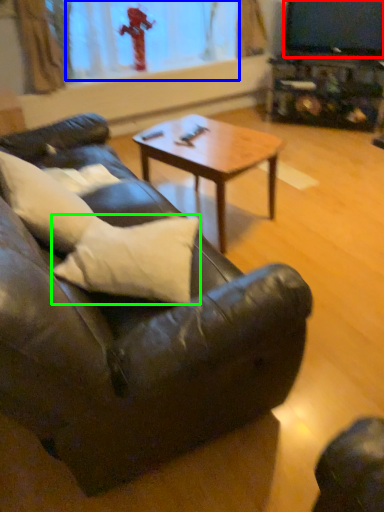
Question: Based on their relative distances, which object is farther from television (highlighted by a red box)? Choose from window screen (highlighted by a blue box) and pillow (highlighted by a green box).

Choices:
 (A) window screen
 (B) pillow

Answer: (B)